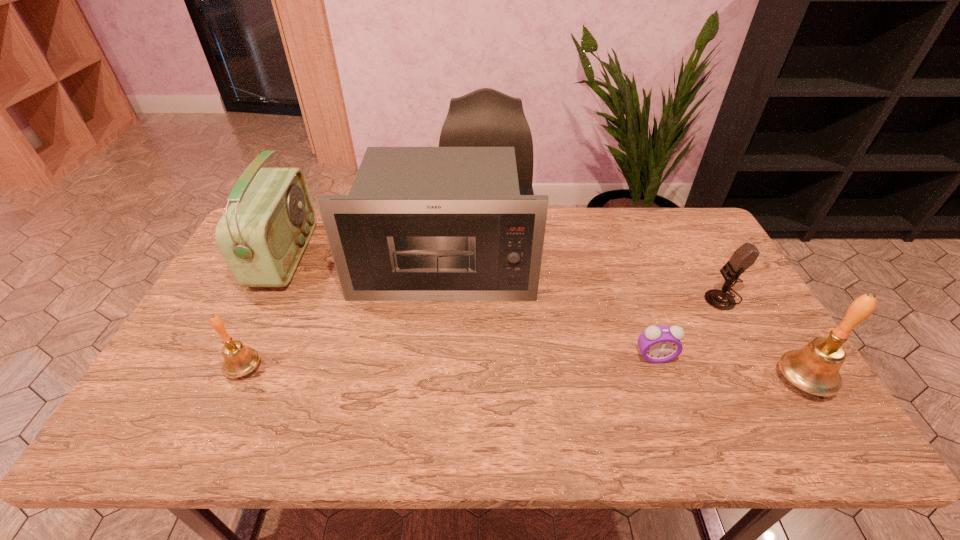
The height and width of the screenshot is (540, 960). Identify the location of empty space that is in between the taller bell and the left bell. (523, 374).

I want to click on vacant region between the left bell and the microphone, so click(483, 333).

Image resolution: width=960 pixels, height=540 pixels. I want to click on free space between the shorter bell and the taller bell, so click(x=523, y=374).

Where is `blank region between the shorter bell and the microphone`? blank region between the shorter bell and the microphone is located at coordinates (483, 333).

This screenshot has height=540, width=960. In order to click on free space between the left bell and the right bell in this screenshot , I will do `click(523, 374)`.

You are a GUI agent. You are given a task and a screenshot of the screen. Output one action in this format:
    pyautogui.click(x=<x>, y=<y>)
    Task: Click on the free space between the right bell and the third object from left to right
    Image resolution: width=960 pixels, height=540 pixels.
    Given the screenshot: What is the action you would take?
    pyautogui.click(x=623, y=325)

The width and height of the screenshot is (960, 540). Identify the location of unoccupied area between the microphone and the alarm clock. (688, 327).

This screenshot has width=960, height=540. Find the location of `empty space between the alarm clock and the left bell`. empty space between the alarm clock and the left bell is located at coordinates (449, 362).

Identify which object is the fifth nearest to the fourth object from left to right. Please provide its 2D coordinates. Your answer should be formatted as a tuple, i.e. [(x, y)], where the tuple contains the x and y coordinates of a point satisfying the conditions above.

[(262, 235)]

Choose which object is the fifth nearest neighbor to the microphone. Please provide its 2D coordinates. Your answer should be formatted as a tuple, i.e. [(x, y)], where the tuple contains the x and y coordinates of a point satisfying the conditions above.

[(262, 235)]